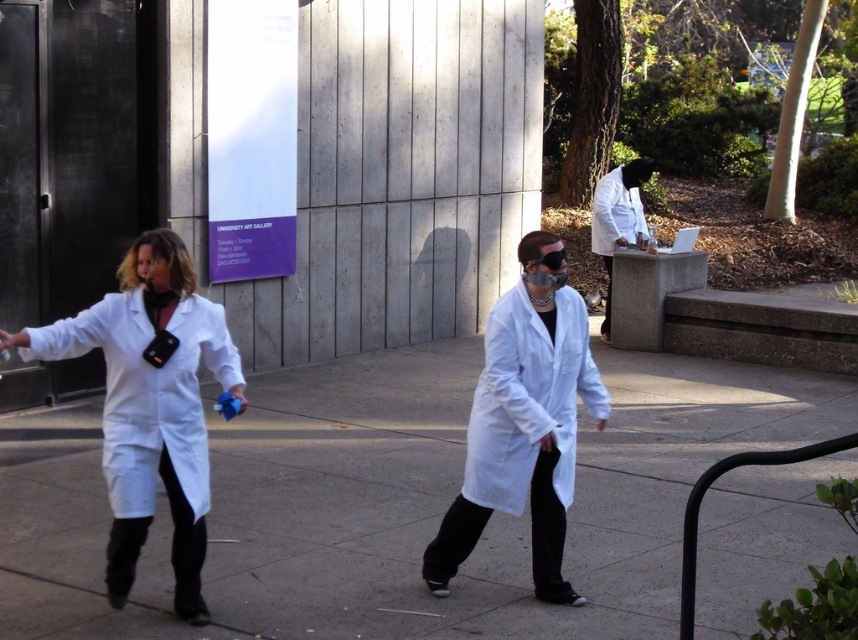
Based on the scene described, which of the two lab coats, the white matte lab coat at left or the matte white lab coat at center, is positioned further to the left?

The white matte lab coat at left is positioned further to the left compared to the matte white lab coat at center.

You are a security guard at the UNIVERSITY ART GALLERY. You need to determine which of the two individuals wearing lab coats is closer to the entrance, which is located to the right side of the image. The individuals are the matte white lab coat at center and the white lab coat at right. Based on their positions, which lab coat is closer to the entrance?

The white lab coat at right is closer to the entrance because it is positioned to the right side of the image, where the entrance is located.